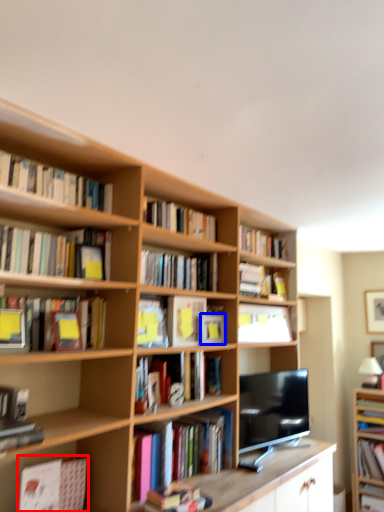
Question: Which object is further to the camera taking this photo, book (highlighted by a red box) or paperback book (highlighted by a blue box)?

Choices:
 (A) book
 (B) paperback book

Answer: (B)